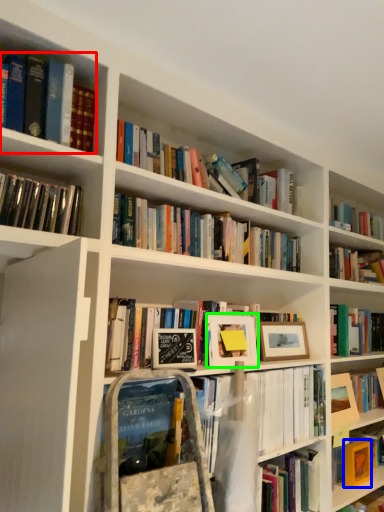
Question: Which object is the closest to the book (highlighted by a red box)? Choose among these: paperback book (highlighted by a blue box) or picture frame (highlighted by a green box).

Choices:
 (A) paperback book
 (B) picture frame

Answer: (B)